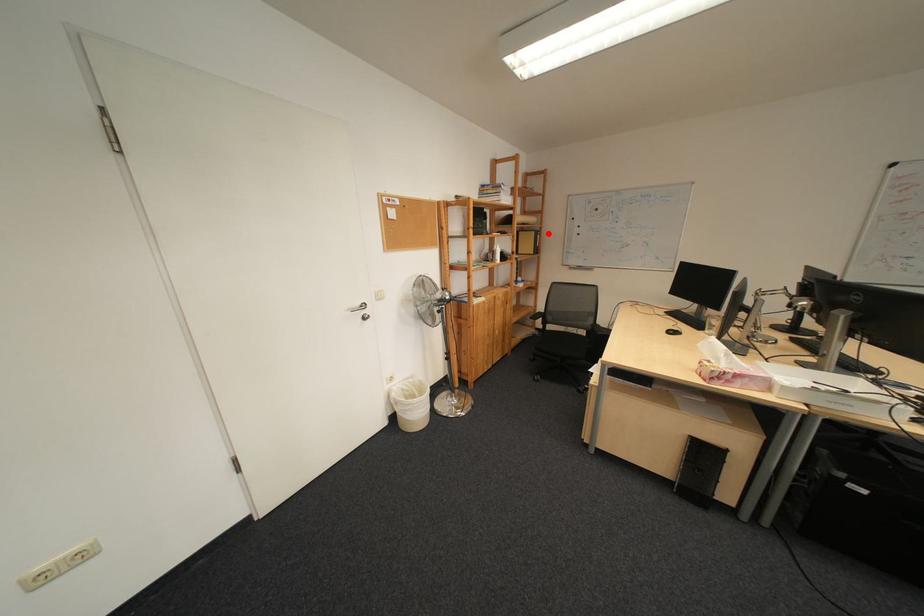
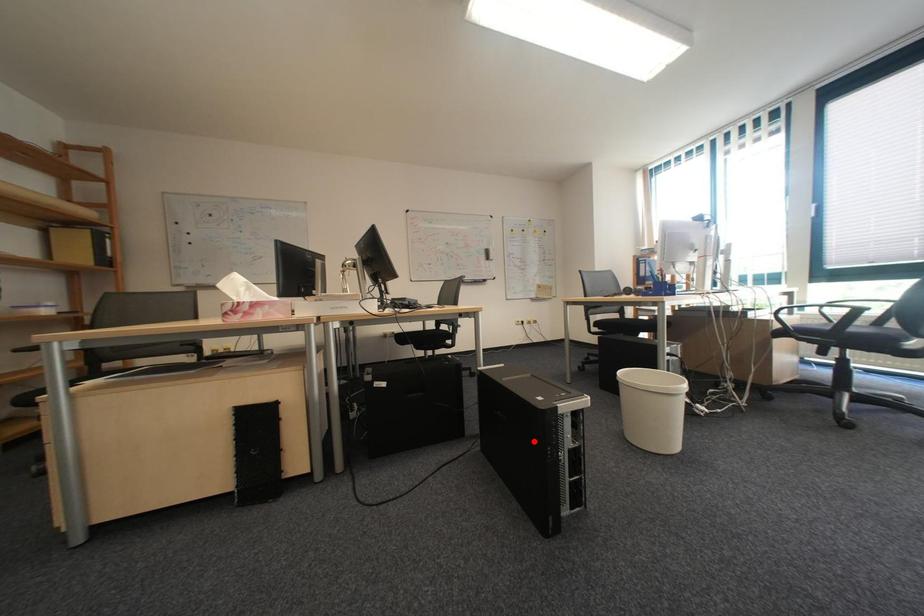
I am providing you with two images of the same scene from different viewpoints. A red point is marked on the first image and another point is marked on the second image. Is the marked point in image1 the same physical position as the marked point in image2?

No